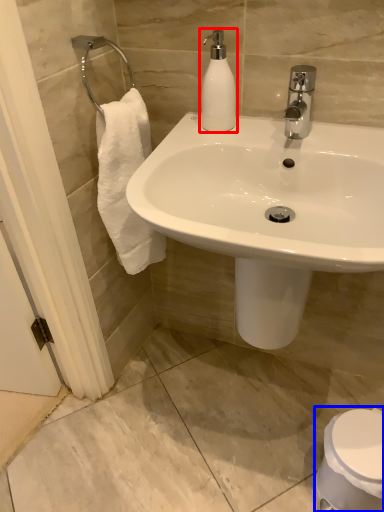
Question: Among these objects, which one is nearest to the camera, soap dispenser (highlighted by a red box) or toilet (highlighted by a blue box)?

Choices:
 (A) soap dispenser
 (B) toilet

Answer: (A)